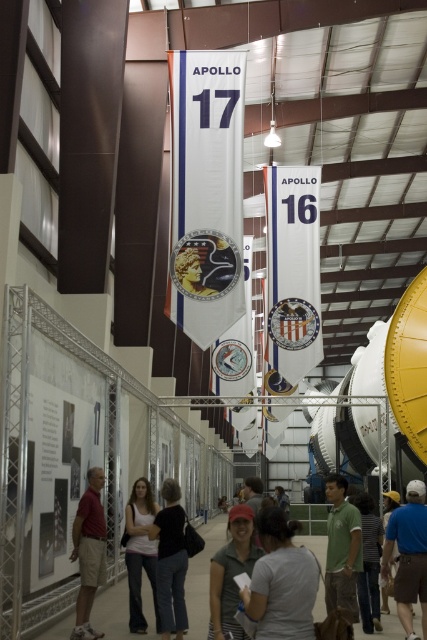
Is green matte shirt at center to the right of red shirt at left from the viewer's perspective?

Indeed, green matte shirt at center is positioned on the right side of red shirt at left.

Is point (335, 518) in front of point (87, 634)?

That is False.

Locate an element on the screen. The image size is (427, 640). green matte shirt at center is located at coordinates (342, 548).

Between dark gray pants at center and green matte shirt at center, which one appears on the left side from the viewer's perspective?

dark gray pants at center is more to the left.

Locate an element on the screen. The image size is (427, 640). dark gray pants at center is located at coordinates tap(170, 561).

Does blue shirt at center have a lesser height compared to red shirt at left?

No.

Where is `blue shirt at center`? The height and width of the screenshot is (640, 427). blue shirt at center is located at coordinates (409, 556).

Is point (415, 602) farther from camera compared to point (84, 522)?

No, it is in front of (84, 522).

At what (x,y) coordinates should I click in order to perform the action: click on blue shirt at center. Please return your answer as a coordinate pair (x, y). This screenshot has height=640, width=427. Looking at the image, I should click on (409, 556).